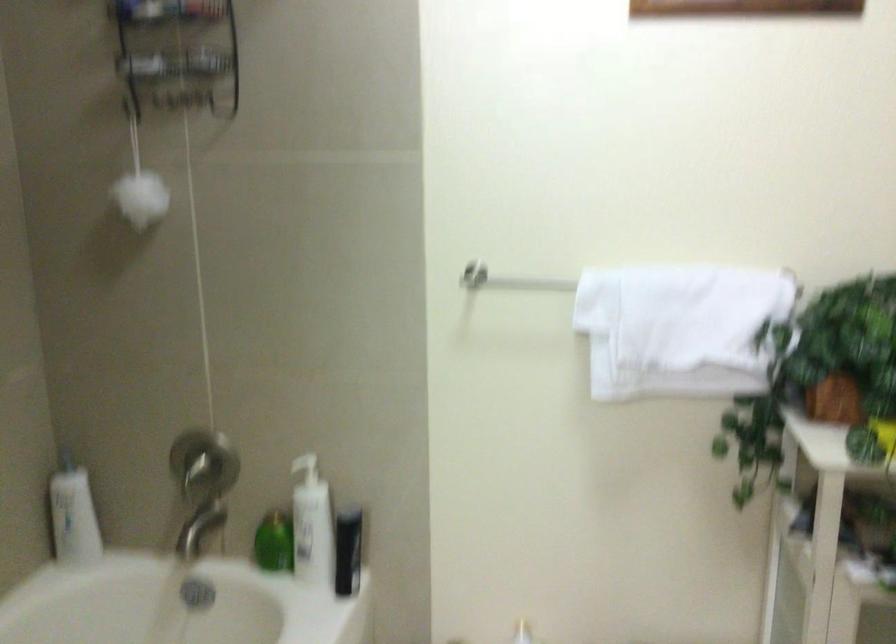
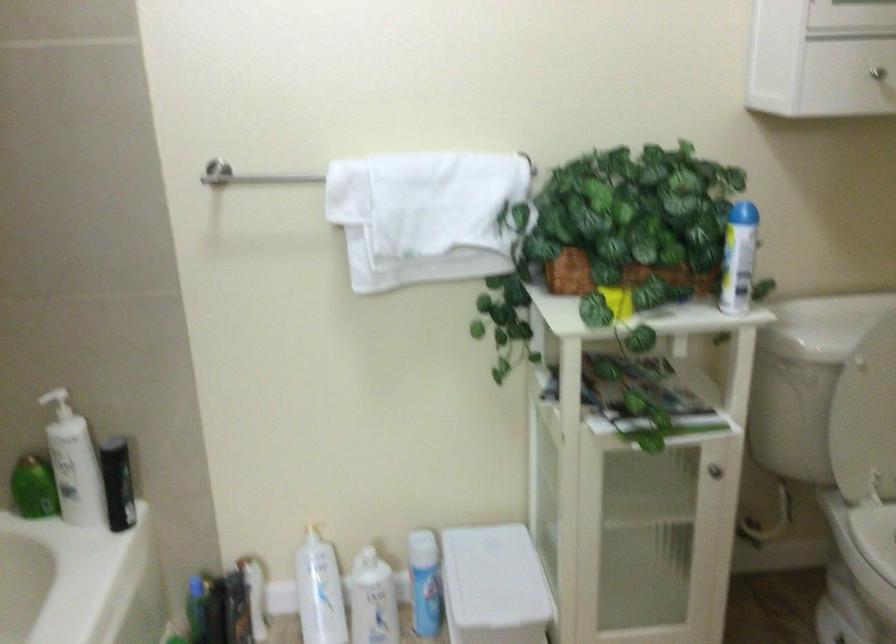
Find the pixel in the second image that matches point 528,275 in the first image.

(278, 176)